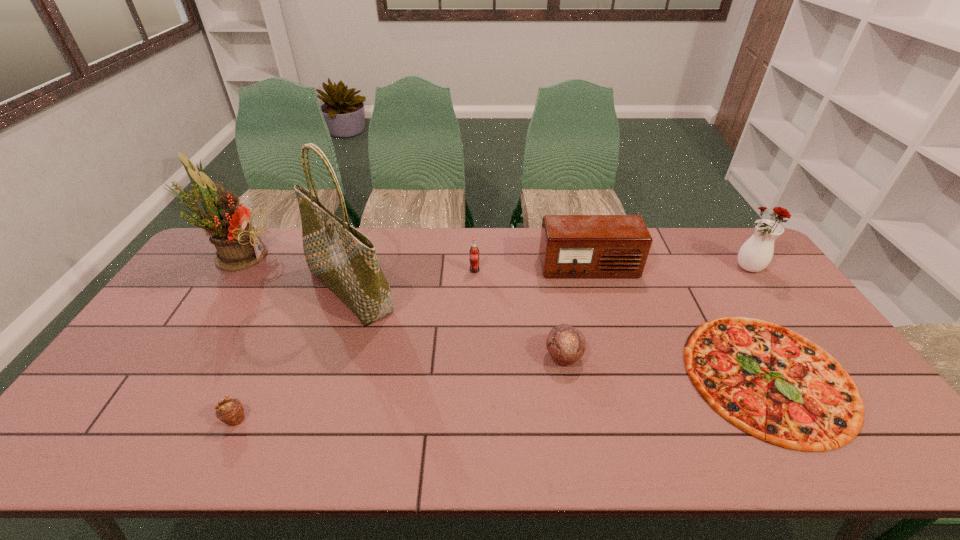
This screenshot has height=540, width=960. What are the coordinates of `empty space that is in between the shortest object and the seventh shortest object` in the screenshot? It's located at (502, 316).

Locate an element on the screen. Image resolution: width=960 pixels, height=540 pixels. unoccupied area between the seventh shortest object and the vase is located at coordinates (493, 262).

Locate an element on the screen. The width and height of the screenshot is (960, 540). empty space between the shorter muffin and the fifth shortest object is located at coordinates (412, 343).

The width and height of the screenshot is (960, 540). I want to click on object that can be found as the closest to the shortest object, so click(571, 246).

Choose which object is the fourth nearest neighbor to the shopping bag. Please provide its 2D coordinates. Your answer should be formatted as a tuple, i.e. [(x, y)], where the tuple contains the x and y coordinates of a point satisfying the conditions above.

[(566, 344)]

This screenshot has width=960, height=540. What are the coordinates of `free spot that satisfies the following two spatial constraints: 1. on the label of the fourth shortest object; 2. on the left side of the pizza` in the screenshot? It's located at (473, 376).

This screenshot has height=540, width=960. Identify the location of free space that satisfies the following two spatial constraints: 1. in front of the flower arrangement with the fan visible; 2. on the right side of the vase. (228, 269).

This screenshot has height=540, width=960. What are the coordinates of `free space that satisfies the following two spatial constraints: 1. in front of the second tallest object with the fan visible; 2. on the left side of the shortest object` in the screenshot? It's located at point(156,376).

Find the location of `vacant space that satisfies the following two spatial constraints: 1. on the back side of the pizza; 2. in front of the flower arrangement with the fan visible`. vacant space that satisfies the following two spatial constraints: 1. on the back side of the pizza; 2. in front of the flower arrangement with the fan visible is located at coordinates (696, 255).